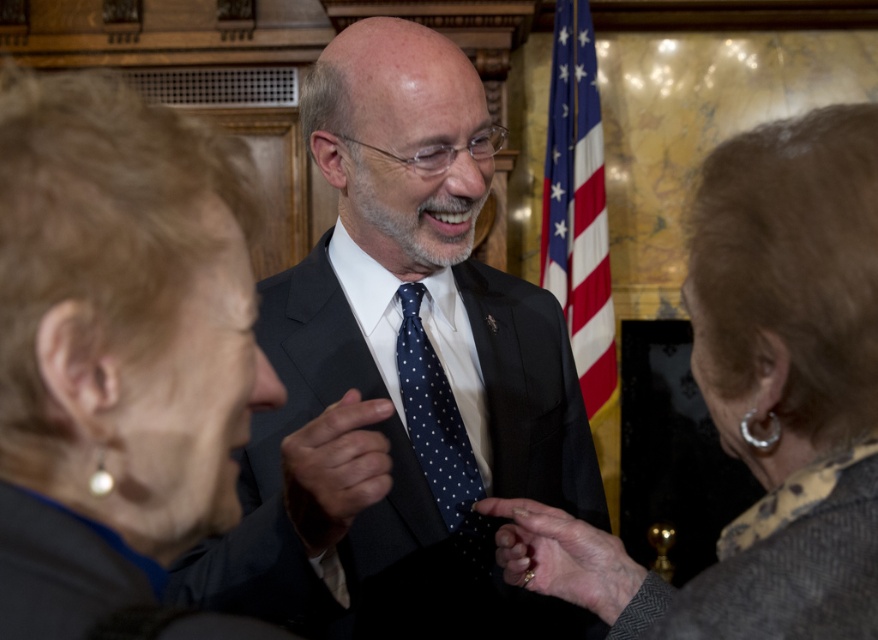
Does red fabric flag at center have a larger size compared to dark blue dotted tie at center?

Correct, red fabric flag at center is larger in size than dark blue dotted tie at center.

Who is higher up, red fabric flag at center or dark blue dotted tie at center?

red fabric flag at center is higher up.

Which is in front, point (592, 273) or point (486, 538)?

Positioned in front is point (486, 538).

Where is `red fabric flag at center`? red fabric flag at center is located at coordinates (578, 208).

Is point (853, 140) closer to viewer compared to point (336, 477)?

Yes, it is.

Does patterned fabric jacket at center have a larger size compared to polished dark blue tie at center?

Yes, patterned fabric jacket at center is bigger than polished dark blue tie at center.

Which is behind, point (639, 625) or point (365, 440)?

The point (365, 440) is more distant.

Locate an element on the screen. This screenshot has height=640, width=878. patterned fabric jacket at center is located at coordinates (761, 401).

Measure the distance from dark gray suit at center to patterned fabric jacket at center.

dark gray suit at center and patterned fabric jacket at center are 3.66 feet apart.

Is dark gray suit at center wider than patterned fabric jacket at center?

Yes.

Between point (299, 502) and point (817, 346), which one is positioned behind?

The point (299, 502) is behind.

This screenshot has height=640, width=878. Find the location of `dark gray suit at center`. dark gray suit at center is located at coordinates (408, 324).